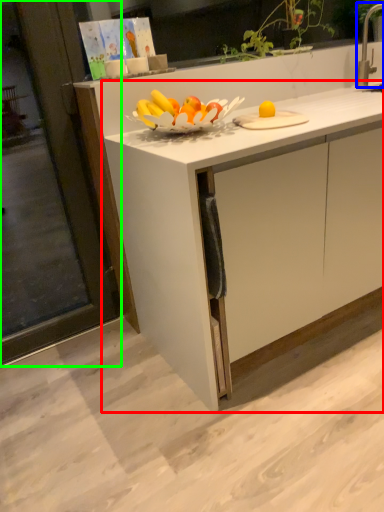
Question: Based on their relative distances, which object is nearer to cabinetry (highlighted by a red box)? Choose from faucet (highlighted by a blue box) and screen door (highlighted by a green box).

Choices:
 (A) faucet
 (B) screen door

Answer: (B)